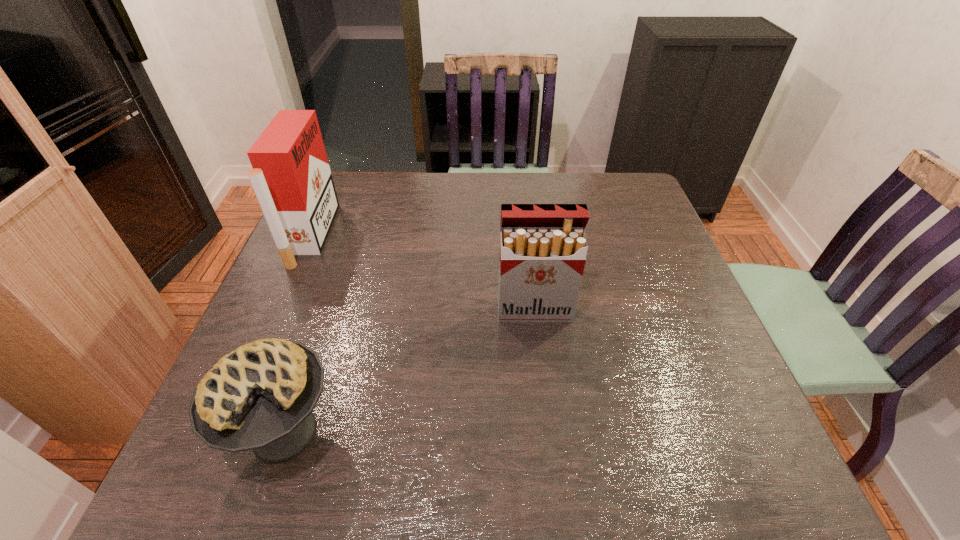
This screenshot has height=540, width=960. Find the location of `the left cigarette case`. the left cigarette case is located at coordinates (291, 177).

I want to click on the farther cigarette case, so click(x=291, y=177).

Locate an element on the screen. The image size is (960, 540). the nearer cigarette case is located at coordinates (543, 247).

The image size is (960, 540). In order to click on the second farthest object in this screenshot , I will do `click(543, 247)`.

Where is `the nearest object`? the nearest object is located at coordinates (261, 396).

This screenshot has height=540, width=960. Find the location of `pie`. pie is located at coordinates (261, 396).

In order to click on vacant area situated 0.370m on the front-facing side of the left cigarette case in this screenshot , I will do `click(461, 235)`.

You are a GUI agent. You are given a task and a screenshot of the screen. Output one action in this format:
    pyautogui.click(x=<x>, y=<y>)
    Task: Click on the vacant area located 0.090m with the lid open on the rightmost object
    
    Given the screenshot: What is the action you would take?
    pyautogui.click(x=540, y=354)

Identify the location of object located in the far edge section of the desktop. This screenshot has height=540, width=960. (291, 177).

Image resolution: width=960 pixels, height=540 pixels. Find the location of `object present at the near edge`. object present at the near edge is located at coordinates (261, 396).